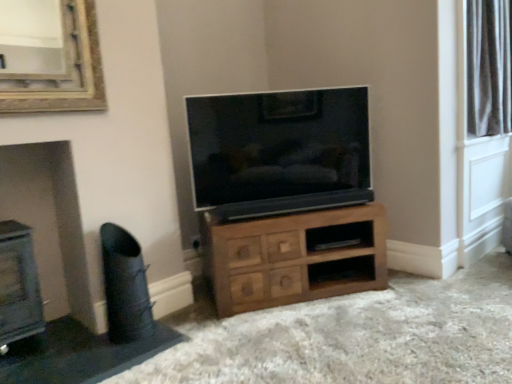
Where is `wooden chest of drawers at center`? Image resolution: width=512 pixels, height=384 pixels. wooden chest of drawers at center is located at coordinates (295, 257).

This screenshot has width=512, height=384. What do you see at coordinates (340, 236) in the screenshot? I see `wooden shelf at center` at bounding box center [340, 236].

Where is `wooden chest of drawers at center`? wooden chest of drawers at center is located at coordinates click(295, 257).

Based on the photo, who is smaller, blue painted wood fireplace at lower left or wooden chest of drawers at center?

blue painted wood fireplace at lower left.

Are blue painted wood fireplace at lower left and wooden chest of drawers at center located far from each other?

That's right, there is a large distance between blue painted wood fireplace at lower left and wooden chest of drawers at center.

Is blue painted wood fireplace at lower left thinner than wooden chest of drawers at center?

Indeed, blue painted wood fireplace at lower left has a lesser width compared to wooden chest of drawers at center.

Which of these two, blue painted wood fireplace at lower left or wooden chest of drawers at center, stands shorter?

wooden chest of drawers at center is shorter.

Which is nearer, (x=477, y=2) or (x=368, y=221)?

Point (x=477, y=2) is positioned farther from the camera compared to point (x=368, y=221).

Could you tell me if silky white curtains at upper right is turned towards wooden shelf at center?

No, silky white curtains at upper right is not aimed at wooden shelf at center.

From a real-world perspective, is matte black tv at center above or below wooden shelf at center?

Clearly, from a real-world perspective, matte black tv at center is above wooden shelf at center.

Does point (357, 94) come in front of point (339, 231)?

No, (357, 94) is further to viewer.

Can you tell me how much matte black tv at center and wooden shelf at center differ in facing direction?

The angle between the facing direction of matte black tv at center and the facing direction of wooden shelf at center is 0.000721 degrees.

Based on the photo, is silky white curtains at upper right to the left of wooden chest of drawers at center from the viewer's perspective?

No, silky white curtains at upper right is not to the left of wooden chest of drawers at center.

Can you tell me how much silky white curtains at upper right and wooden chest of drawers at center differ in facing direction?

The angle between the facing direction of silky white curtains at upper right and the facing direction of wooden chest of drawers at center is 28.4 degrees.

Measure the distance between silky white curtains at upper right and wooden chest of drawers at center.

silky white curtains at upper right is 1.50 meters away from wooden chest of drawers at center.

Considering the sizes of silky white curtains at upper right and wooden chest of drawers at center in the image, is silky white curtains at upper right wider or thinner than wooden chest of drawers at center?

Considering their sizes, silky white curtains at upper right looks slimmer than wooden chest of drawers at center.

Considering the sizes of wooden chest of drawers at center and black leather swivel chair at lower left in the image, is wooden chest of drawers at center taller or shorter than black leather swivel chair at lower left?

wooden chest of drawers at center is shorter than black leather swivel chair at lower left.

Between point (292, 215) and point (112, 335), which one is positioned in front?

The point (112, 335) is more forward.

Can you confirm if wooden chest of drawers at center is positioned to the left of black leather swivel chair at lower left?

No.

From a real-world perspective, is wooden chest of drawers at center above or below black leather swivel chair at lower left?

wooden chest of drawers at center is situated lower than black leather swivel chair at lower left in the real world.

Is matte black tv at center to the left or to the right of silky white curtains at upper right in the image?

From the image, it's evident that matte black tv at center is to the left of silky white curtains at upper right.

Is matte black tv at center bigger than silky white curtains at upper right?

Indeed, matte black tv at center has a larger size compared to silky white curtains at upper right.

From a real-world perspective, is matte black tv at center positioned over silky white curtains at upper right based on gravity?

Incorrect, from a real-world perspective, matte black tv at center is lower than silky white curtains at upper right.

Can you confirm if black leather swivel chair at lower left is smaller than wooden shelf at center?

Actually, black leather swivel chair at lower left might be larger than wooden shelf at center.

Between black leather swivel chair at lower left and wooden shelf at center, which one appears on the left side from the viewer's perspective?

black leather swivel chair at lower left.

In the image, is black leather swivel chair at lower left positioned in front of or behind wooden shelf at center?

Clearly, black leather swivel chair at lower left is in front of wooden shelf at center.

Find the location of a particular element. chest of drawers below the blue painted wood fireplace at lower left (from a real-world perspective) is located at coordinates (295, 257).

Image resolution: width=512 pixels, height=384 pixels. What are the coordinates of `bay window lying above the wooden shelf at center (from the image's perspective)` in the screenshot? It's located at (488, 68).

Estimate the real-world distances between objects in this image. Which object is closer to black leather swivel chair at lower left, wooden shelf at center or matte black tv at center?

Based on the image, matte black tv at center appears to be nearer to black leather swivel chair at lower left.

Considering their positions, is matte black tv at center positioned closer to black leather swivel chair at lower left than wooden chest of drawers at center?

Among the two, wooden chest of drawers at center is located nearer to black leather swivel chair at lower left.

From the image, which object appears to be nearer to black leather swivel chair at lower left, blue painted wood fireplace at lower left or wooden shelf at center?

Among the two, blue painted wood fireplace at lower left is located nearer to black leather swivel chair at lower left.

Looking at the image, which one is located further to blue painted wood fireplace at lower left, wooden shelf at center or silky white curtains at upper right?

silky white curtains at upper right lies further to blue painted wood fireplace at lower left than the other object.

Estimate the real-world distances between objects in this image. Which object is further from wooden chest of drawers at center, silky white curtains at upper right or blue painted wood fireplace at lower left?

silky white curtains at upper right is further to wooden chest of drawers at center.

Considering their positions, is wooden chest of drawers at center positioned further to blue painted wood fireplace at lower left than wooden shelf at center?

The object further to blue painted wood fireplace at lower left is wooden shelf at center.

Looking at the image, which one is located closer to matte black tv at center, black leather swivel chair at lower left or silky white curtains at upper right?

black leather swivel chair at lower left is positioned closer to the anchor matte black tv at center.

Based on their spatial positions, is matte black tv at center or wooden chest of drawers at center further from blue painted wood fireplace at lower left?

matte black tv at center lies further to blue painted wood fireplace at lower left than the other object.

I want to click on television between blue painted wood fireplace at lower left and wooden shelf at center, so click(x=279, y=151).

Locate an element on the screen. television situated between blue painted wood fireplace at lower left and silky white curtains at upper right from left to right is located at coordinates click(x=279, y=151).

Locate an element on the screen. chest of drawers between matte black tv at center and silky white curtains at upper right in the horizontal direction is located at coordinates pyautogui.click(x=295, y=257).

Where is `shelf between wooden chest of drawers at center and silky white curtains at upper right`? shelf between wooden chest of drawers at center and silky white curtains at upper right is located at coordinates (340, 236).